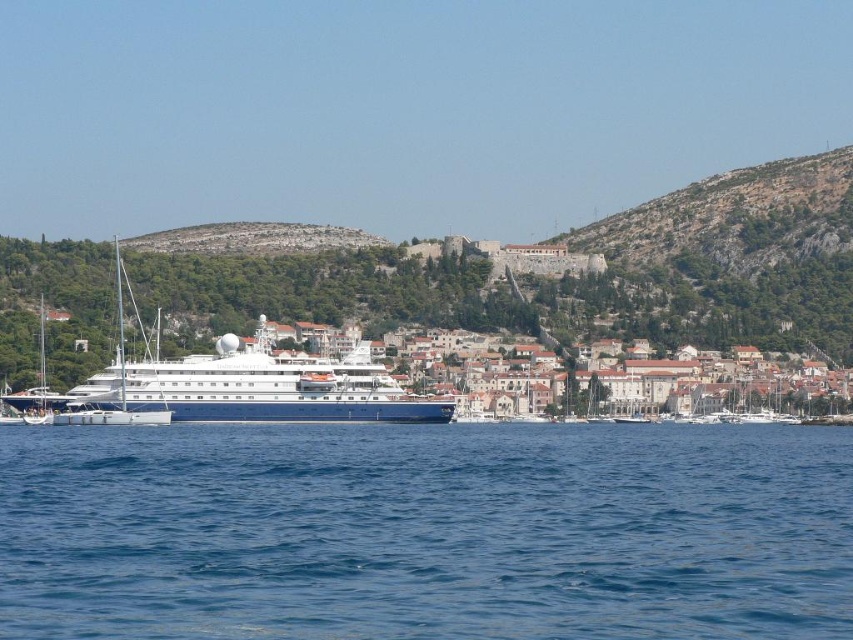
Question: Which point is farther to the camera?

Choices:
 (A) (257, 323)
 (B) (71, 602)

Answer: (A)

Question: Is blue liquid water at center behind white glossy cruise ship at center?

Choices:
 (A) no
 (B) yes

Answer: (A)

Question: Which object is farther from the camera taking this photo?

Choices:
 (A) white glossy cruise ship at center
 (B) blue liquid water at center

Answer: (A)

Question: Can you confirm if blue liquid water at center is positioned below white glossy cruise ship at center?

Choices:
 (A) no
 (B) yes

Answer: (B)

Question: Which point appears farthest from the camera in this image?

Choices:
 (A) (387, 384)
 (B) (234, 624)

Answer: (A)

Question: Is blue liquid water at center wider than white glossy cruise ship at center?

Choices:
 (A) no
 (B) yes

Answer: (B)